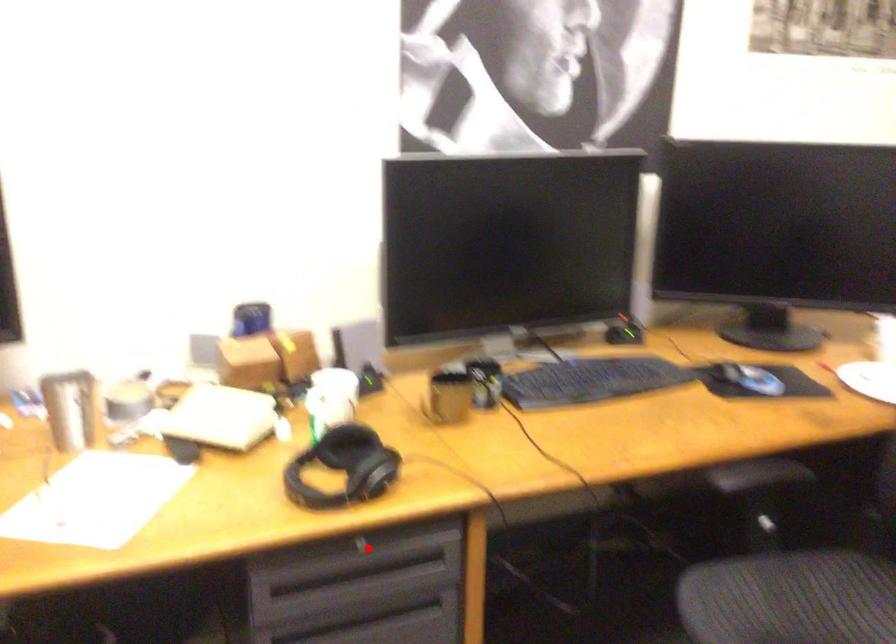
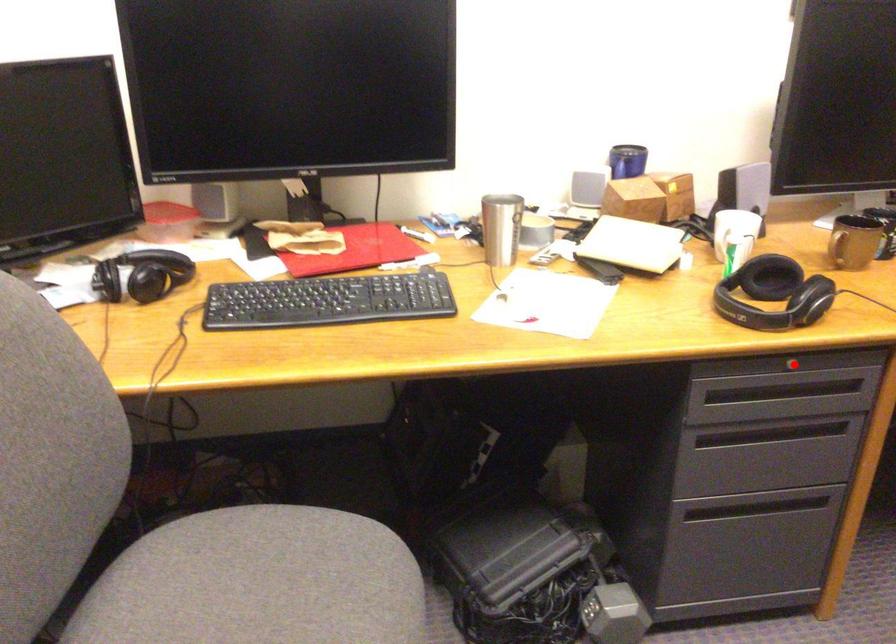
I am providing you with two images of the same scene from different viewpoints. A red point is marked on the first image and another point is marked on the second image. Is the red point in image1 aligned with the point shown in image2?

Yes